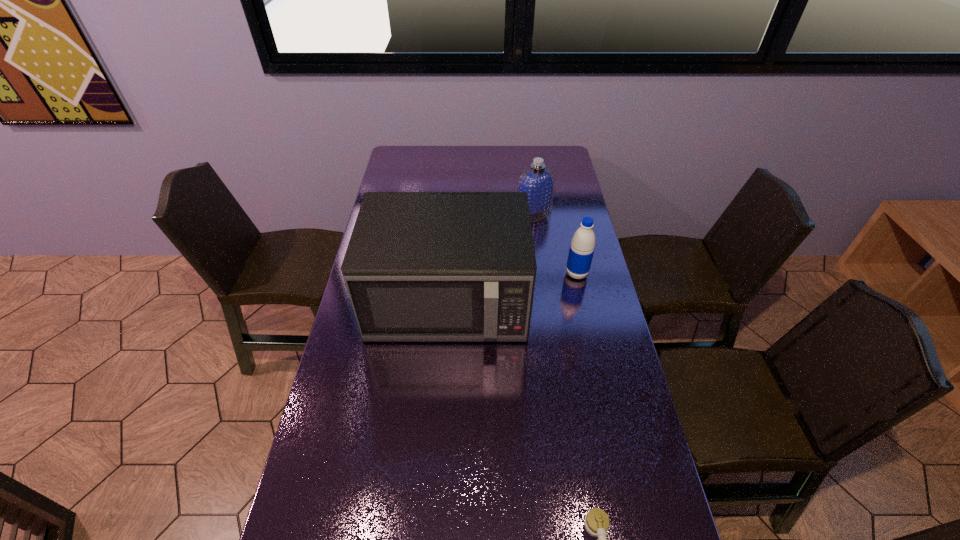
Where is `vacant space at the left edge of the desktop`? This screenshot has width=960, height=540. vacant space at the left edge of the desktop is located at coordinates (347, 478).

You are a GUI agent. You are given a task and a screenshot of the screen. Output one action in this format:
    pyautogui.click(x=<x>, y=<y>)
    Task: Click on the free space at the right edge of the desktop
    
    Given the screenshot: What is the action you would take?
    pyautogui.click(x=586, y=368)

Locate an element on the screen. The height and width of the screenshot is (540, 960). free space at the far left corner of the desktop is located at coordinates (395, 168).

This screenshot has width=960, height=540. In order to click on free space that is in between the rightmost object and the farthest object in this screenshot , I will do `click(555, 244)`.

Where is `the third closest object to the tallest object`? the third closest object to the tallest object is located at coordinates (596, 521).

Locate an element on the screen. the second closest object relative to the rightmost object is located at coordinates (538, 181).